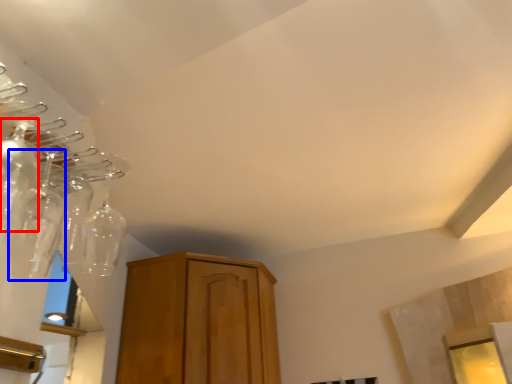
Question: Which object is further to the camera taking this photo, glass bottle (highlighted by a red box) or glass bottle (highlighted by a blue box)?

Choices:
 (A) glass bottle
 (B) glass bottle

Answer: (B)